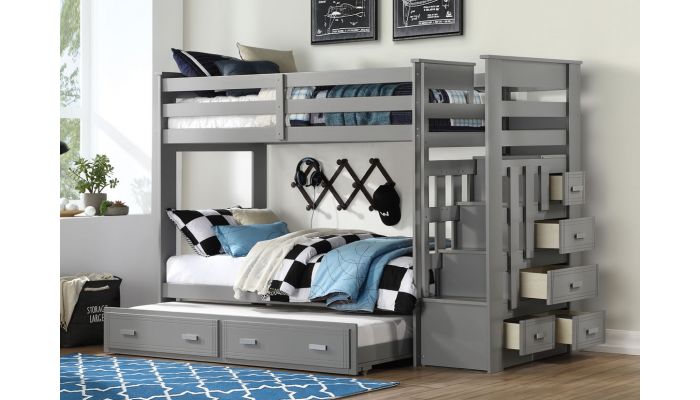
Identify the location of wall. This screenshot has width=700, height=400. (574, 26).